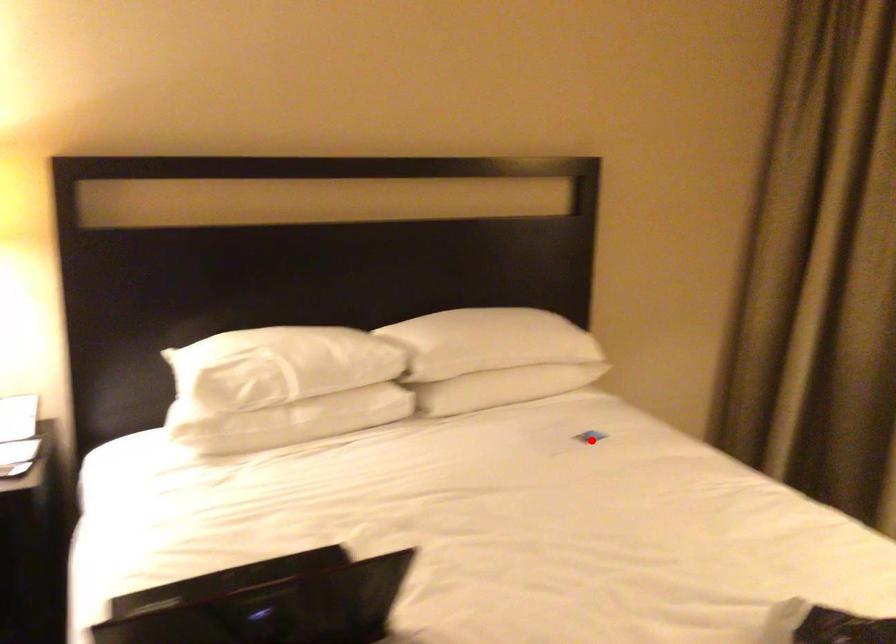
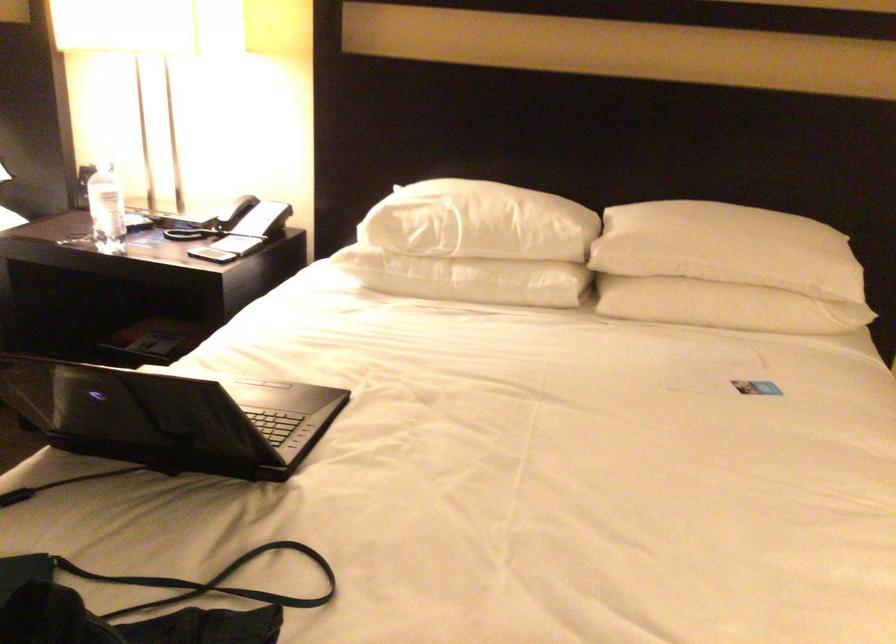
Find the pixel in the second image that matches the highlighted location in the first image.

(755, 386)